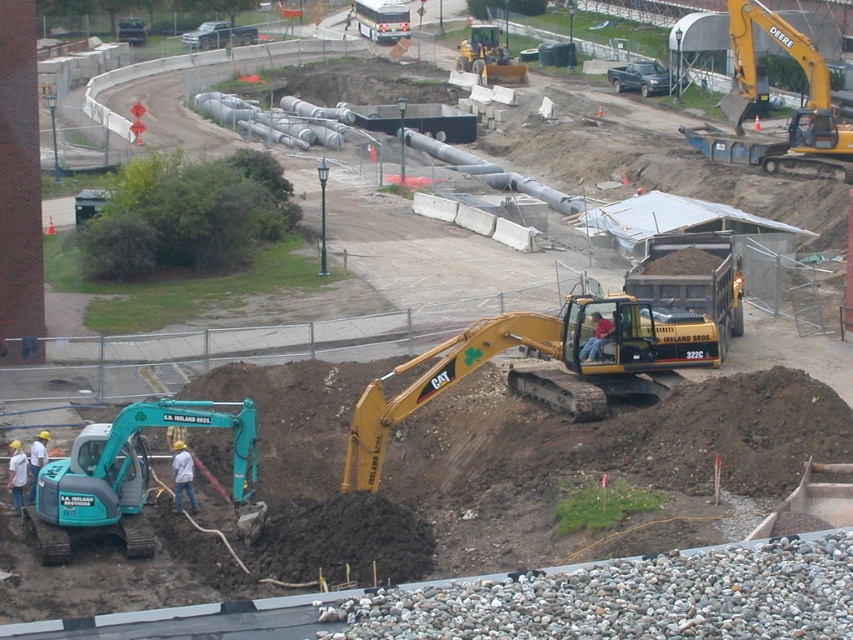
Question: Is teal rubber excavator at lower left positioned behind yellow rubber excavator at upper right?

Choices:
 (A) no
 (B) yes

Answer: (A)

Question: Which point is farther to the camera?

Choices:
 (A) coord(247,497)
 (B) coord(192,481)
 (C) coord(596,321)
 (D) coord(815,100)

Answer: (D)

Question: Considering the relative positions of brown soil at lower left and red shirt construction worker at center in the image provided, where is brown soil at lower left located with respect to red shirt construction worker at center?

Choices:
 (A) left
 (B) right

Answer: (A)

Question: Which object is farther from the camera taking this photo?

Choices:
 (A) yellow metallic excavator at center
 (B) brown soil at lower left
 (C) yellow rubber excavator at upper right
 (D) light blue jeans at lower left

Answer: (C)

Question: Can you confirm if teal rubber excavator at lower left is positioned above yellow rubber excavator at upper right?

Choices:
 (A) yes
 (B) no

Answer: (B)

Question: Which of the following is the closest to the observer?

Choices:
 (A) light blue jeans at lower left
 (B) red shirt construction worker at center

Answer: (A)